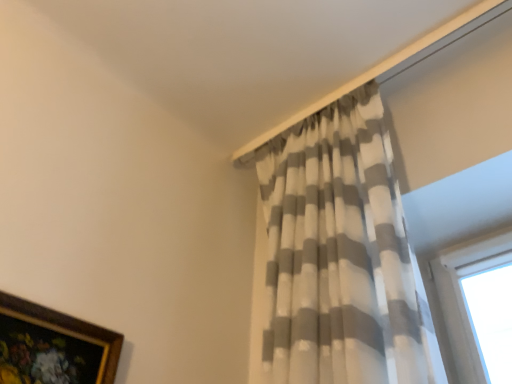
I want to click on gold-framed floral painting at lower left, so click(x=53, y=346).

Measure the distance between gold-framed floral painting at lower left and camera.

gold-framed floral painting at lower left is 88.50 centimeters from camera.

What do you see at coordinates (53, 346) in the screenshot? I see `gold-framed floral painting at lower left` at bounding box center [53, 346].

The width and height of the screenshot is (512, 384). Find the location of `gold-framed floral painting at lower left`. gold-framed floral painting at lower left is located at coordinates (53, 346).